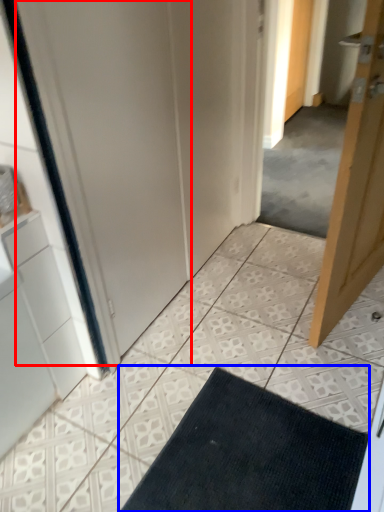
Question: Which object appears closest to the camera in this image, screen door (highlighted by a red box) or bath mat (highlighted by a blue box)?

Choices:
 (A) screen door
 (B) bath mat

Answer: (A)